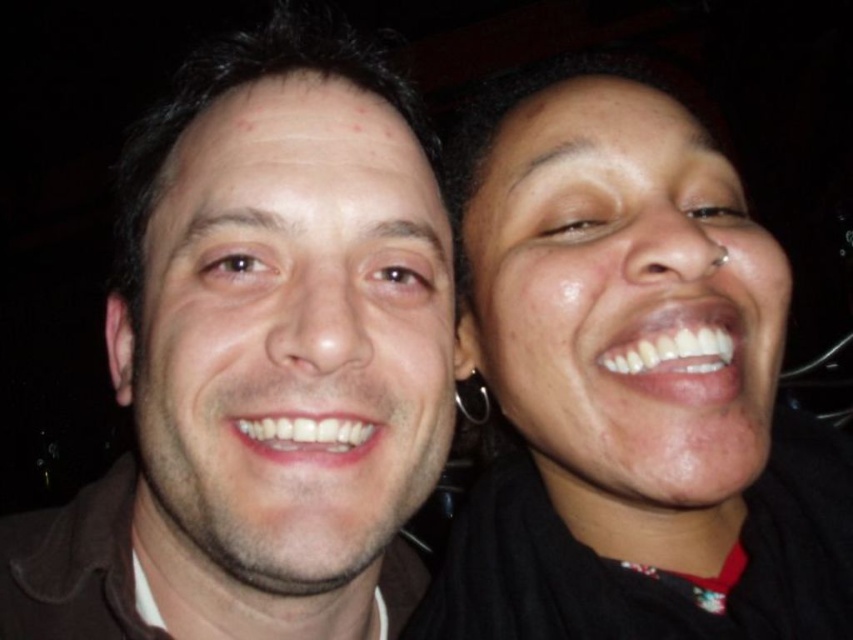
You are a photographer trying to adjust the focus of your camera. You need to ensure both the matte skin face at left and the silver metallic hoop earring at upper right are in focus. Given their sizes, which object should you prioritize focusing on first?

The matte skin face at left has a larger size compared to the silver metallic hoop earring at upper right, so you should prioritize focusing on the matte skin face at left first to ensure it is sharp, as larger objects often require more precise focus adjustments.

You are a photographer trying to adjust the lighting for a portrait. You notice a point at coordinates (288, 340) where a matte skin face at left is located. To ensure proper exposure, should you adjust the light to be brighter or dimmer at that point?

The point at (288, 340) has a matte skin face at left, so you should adjust the light to be brighter there to properly illuminate the matte skin and ensure even exposure across the subjects.

Based on the scene description, where is the matte skin face at left positioned in the image?

The matte skin face at left is positioned at point coordinates of 0.533 on the x axis and 0.339 on the y axis.